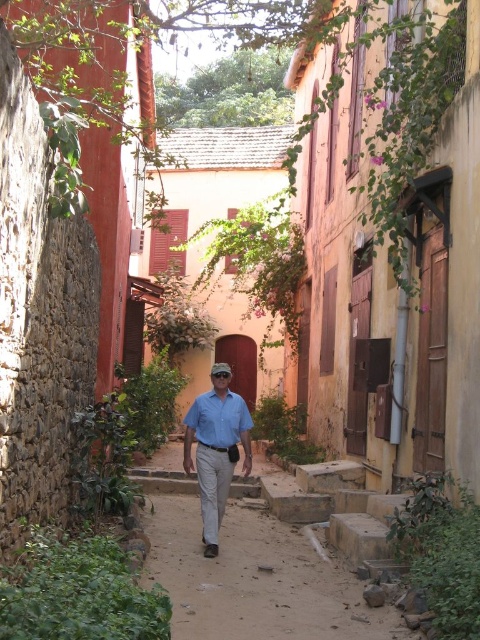
Between point (244, 449) and point (211, 440), which one is positioned behind?

Point (244, 449)

Is matte blue shirt at center below blue cotton shirt at center?

Indeed, matte blue shirt at center is positioned under blue cotton shirt at center.

Which is in front, point (212, 516) or point (210, 412)?

Positioned in front is point (212, 516).

The width and height of the screenshot is (480, 640). I want to click on matte blue shirt at center, so click(216, 449).